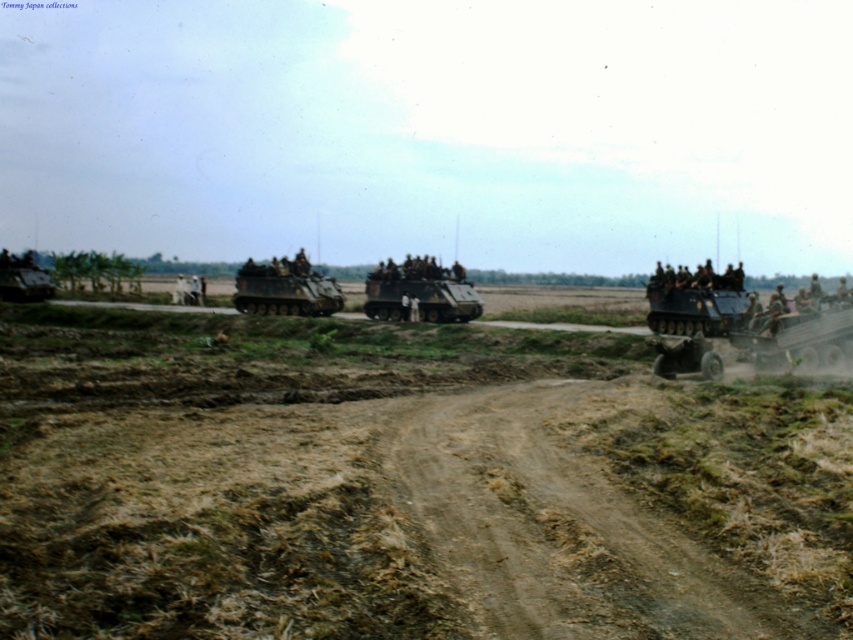
Question: Is brown dirt track at center to the right of matte green tank at center from the viewer's perspective?

Choices:
 (A) no
 (B) yes

Answer: (B)

Question: Is the position of brown dirt track at center more distant than that of matte black armored personnel carrier at center?

Choices:
 (A) yes
 (B) no

Answer: (B)

Question: Among these objects, which one is farthest from the camera?

Choices:
 (A) matte black armored personnel carrier at center
 (B) brown dirt track at center
 (C) matte green tank at lower left

Answer: (C)

Question: Can you confirm if brown dirt track at center is thinner than matte black armored personnel carrier at center?

Choices:
 (A) no
 (B) yes

Answer: (B)

Question: Which point is farther to the camera?

Choices:
 (A) matte green tank at center
 (B) matte green tank at lower left
 (C) matte black armored personnel carrier at right

Answer: (B)

Question: Among these points, which one is nearest to the camera?

Choices:
 (A) (410, 292)
 (B) (590, 538)
 (C) (305, 259)
 (D) (669, 323)

Answer: (B)